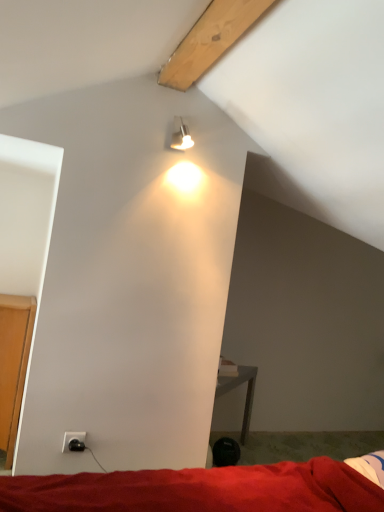
Question: Should I look upward or downward to see metallic silver spotlight at upper center?

Choices:
 (A) down
 (B) up

Answer: (B)

Question: From the image's perspective, is red fabric bed at lower center above metallic silver spotlight at upper center?

Choices:
 (A) no
 (B) yes

Answer: (A)

Question: Does red fabric bed at lower center have a lesser width compared to metallic silver spotlight at upper center?

Choices:
 (A) no
 (B) yes

Answer: (A)

Question: Is red fabric bed at lower center not inside metallic silver spotlight at upper center?

Choices:
 (A) yes
 (B) no

Answer: (A)

Question: Could you tell me if red fabric bed at lower center is facing metallic silver spotlight at upper center?

Choices:
 (A) no
 (B) yes

Answer: (A)

Question: Does red fabric bed at lower center have a larger size compared to metallic silver spotlight at upper center?

Choices:
 (A) yes
 (B) no

Answer: (A)

Question: Is the depth of red fabric bed at lower center less than that of metallic silver spotlight at upper center?

Choices:
 (A) yes
 (B) no

Answer: (A)

Question: Can you confirm if black plastic power outlet at lower left is wider than metallic silver spotlight at upper center?

Choices:
 (A) yes
 (B) no

Answer: (B)

Question: Is black plastic power outlet at lower left not near metallic silver spotlight at upper center?

Choices:
 (A) yes
 (B) no

Answer: (A)

Question: From a real-world perspective, is black plastic power outlet at lower left physically below metallic silver spotlight at upper center?

Choices:
 (A) no
 (B) yes

Answer: (B)

Question: Is black plastic power outlet at lower left facing towards metallic silver spotlight at upper center?

Choices:
 (A) yes
 (B) no

Answer: (B)

Question: Would you say black plastic power outlet at lower left is outside metallic silver spotlight at upper center?

Choices:
 (A) no
 (B) yes

Answer: (B)

Question: Considering the relative positions of black plastic power outlet at lower left and metallic silver spotlight at upper center in the image provided, is black plastic power outlet at lower left in front of metallic silver spotlight at upper center?

Choices:
 (A) no
 (B) yes

Answer: (B)

Question: Is red fabric bed at lower center facing towards black plastic power outlet at lower left?

Choices:
 (A) no
 (B) yes

Answer: (A)